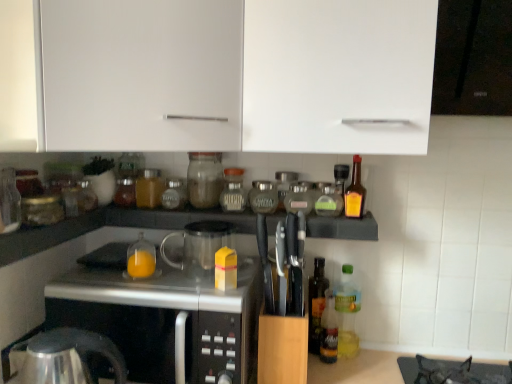
Identify the location of free space in front of translucent glass bottle at center, the second orange juice when ordered from right to left. Image resolution: width=512 pixels, height=384 pixels. (137, 289).